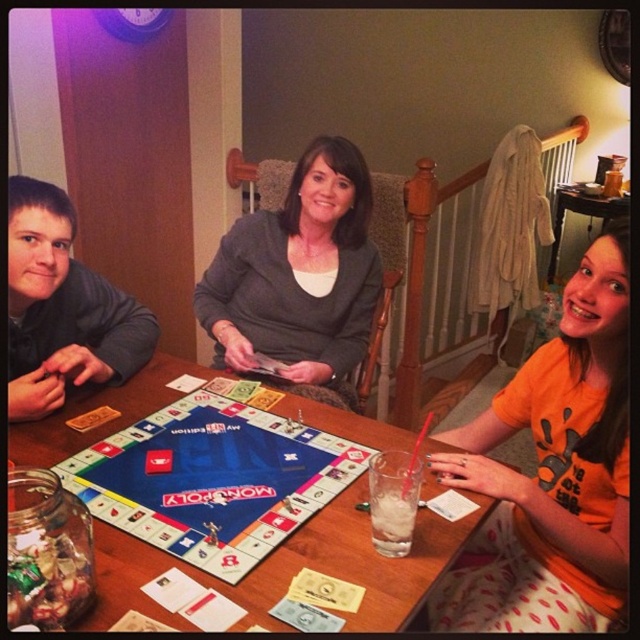
Can you confirm if orange cotton t-shirt at lower right is positioned to the left of gray sweater at center?

Incorrect, orange cotton t-shirt at lower right is not on the left side of gray sweater at center.

Based on the photo, which is more to the right, orange cotton t-shirt at lower right or gray sweater at center?

orange cotton t-shirt at lower right is more to the right.

The height and width of the screenshot is (640, 640). Describe the element at coordinates (554, 472) in the screenshot. I see `orange cotton t-shirt at lower right` at that location.

You are a GUI agent. You are given a task and a screenshot of the screen. Output one action in this format:
    pyautogui.click(x=<x>, y=<y>)
    Task: Click on the orange cotton t-shirt at lower right
    The height and width of the screenshot is (640, 640).
    Given the screenshot: What is the action you would take?
    (x=554, y=472)

Which is more to the right, gray sweater at center or dark gray sweater at left?

From the viewer's perspective, gray sweater at center appears more on the right side.

Between point (241, 285) and point (22, 417), which one is positioned in front?

Point (22, 417) is more forward.

Where is `gray sweater at center`? The height and width of the screenshot is (640, 640). gray sweater at center is located at coordinates (298, 275).

Can you confirm if orange cotton t-shirt at lower right is wider than dark gray sweater at left?

Indeed, orange cotton t-shirt at lower right has a greater width compared to dark gray sweater at left.

Based on the photo, is orange cotton t-shirt at lower right shorter than dark gray sweater at left?

No.

Image resolution: width=640 pixels, height=640 pixels. What do you see at coordinates (554, 472) in the screenshot? I see `orange cotton t-shirt at lower right` at bounding box center [554, 472].

Find the location of a particular element. orange cotton t-shirt at lower right is located at coordinates (554, 472).